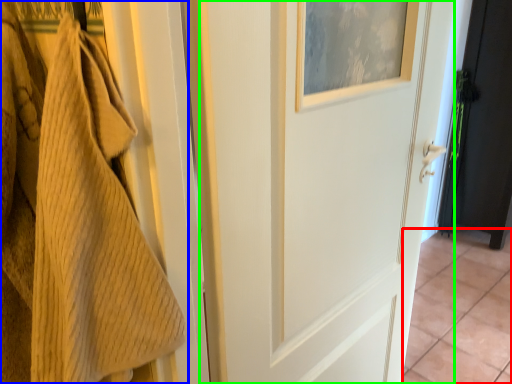
Question: Which object is the closest to the tile (highlighted by a red box)? Choose among these: towel (highlighted by a blue box) or door (highlighted by a green box).

Choices:
 (A) towel
 (B) door

Answer: (B)